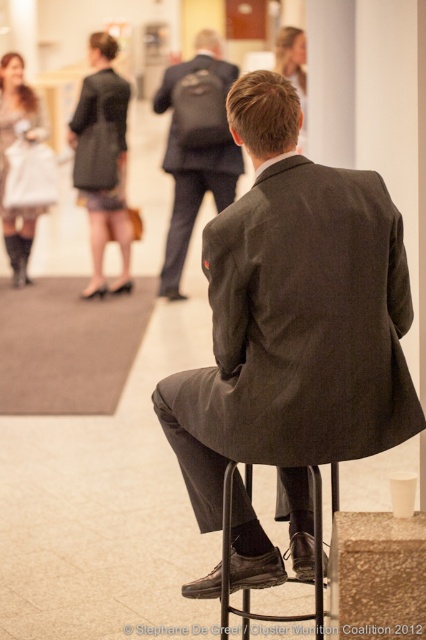
Question: Which object is positioned farthest from the smooth brown hair at upper center?

Choices:
 (A) dark gray suit at center
 (B) black leather bar stool at lower center
 (C) matte black boots at left
 (D) dark gray textured coat at upper left

Answer: (B)

Question: Can you confirm if dark gray textured coat at upper left is thinner than smooth brown hair at upper center?

Choices:
 (A) no
 (B) yes

Answer: (A)

Question: Estimate the real-world distances between objects in this image. Which object is closer to the black leather bar stool at lower center?

Choices:
 (A) dark gray suit at center
 (B) smooth brown hair at upper center

Answer: (A)

Question: Does dark gray textured coat at upper left have a larger size compared to matte black boots at left?

Choices:
 (A) yes
 (B) no

Answer: (A)

Question: Which point is farther to the camera?

Choices:
 (A) (101, 216)
 (B) (209, 172)
 (C) (219, 563)

Answer: (A)

Question: Is matte black suit at center wider than matte black boots at left?

Choices:
 (A) no
 (B) yes

Answer: (B)